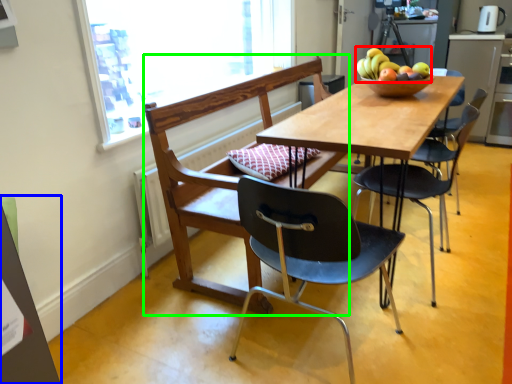
Question: Which object is the farthest from fruit (highlighted by a red box)? Choose among these: bulletin board (highlighted by a blue box) or chair (highlighted by a green box).

Choices:
 (A) bulletin board
 (B) chair

Answer: (A)